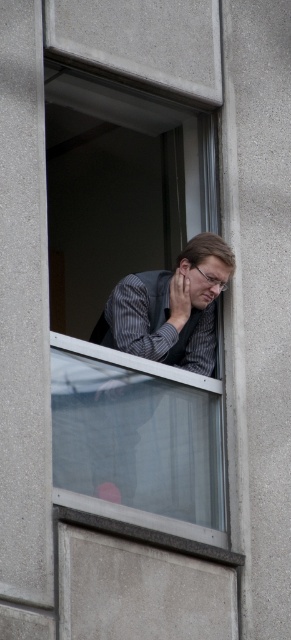
You are an interior designer assessing the space in the image. You notice the clear glass window at center and the matte gray vest at center. Which object occupies more vertical space in the scene?

The clear glass window at center is taller than the matte gray vest at center, so it occupies more vertical space.

You are a window cleaner who needs to clean the clear glass window at center and the matte gray vest at center. Which object requires a wider cleaning tool? Please explain your reasoning based on the scene description.

The clear glass window at center might be wider than matte gray vest at center, so it requires a wider cleaning tool.